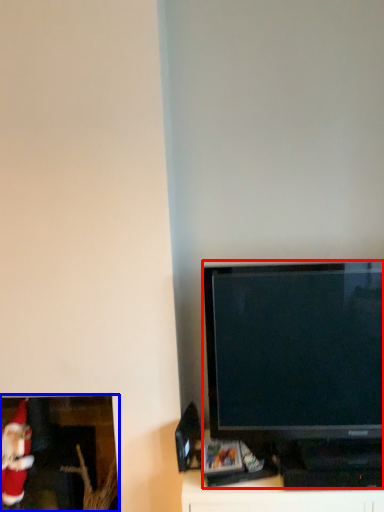
Question: Which point is closer to the camera, television (highlighted by a red box) or picture frame (highlighted by a blue box)?

Choices:
 (A) television
 (B) picture frame

Answer: (A)